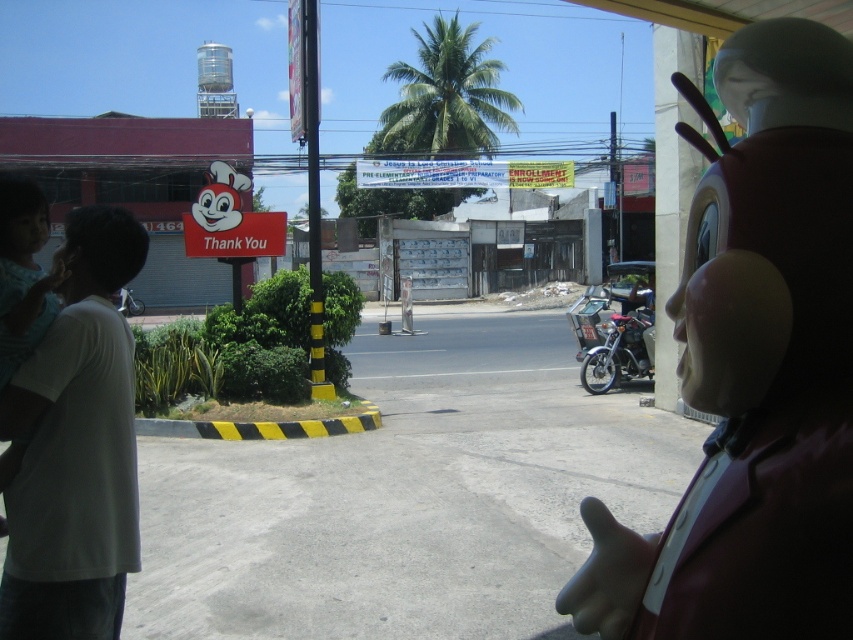
Does smooth brown statue at right have a greater width compared to metallic silver motorcycle at right?

Incorrect, smooth brown statue at right's width does not surpass metallic silver motorcycle at right's.

Between point (833, 65) and point (633, 342), which one is positioned behind?

The point (633, 342) is more distant.

Find the location of a particular element. The width and height of the screenshot is (853, 640). smooth brown statue at right is located at coordinates (753, 368).

Does smooth brown statue at right appear under white cotton shirt at left?

No.

Is smooth brown statue at right shorter than white cotton shirt at left?

Correct, smooth brown statue at right is not as tall as white cotton shirt at left.

Between point (741, 340) and point (119, 595), which one is positioned in front?

Point (741, 340) is in front.

Image resolution: width=853 pixels, height=640 pixels. What are the coordinates of `smooth brown statue at right` in the screenshot? It's located at (753, 368).

Can you confirm if white cotton shirt at left is bigger than metallic silver motorcycle at right?

No, white cotton shirt at left is not bigger than metallic silver motorcycle at right.

Is white cotton shirt at left smaller than metallic silver motorcycle at right?

Indeed, white cotton shirt at left has a smaller size compared to metallic silver motorcycle at right.

Is point (41, 620) positioned behind point (637, 376)?

That is False.

At what (x,y) coordinates should I click in order to perform the action: click on white cotton shirt at left. Please return your answer as a coordinate pair (x, y). Looking at the image, I should click on (74, 448).